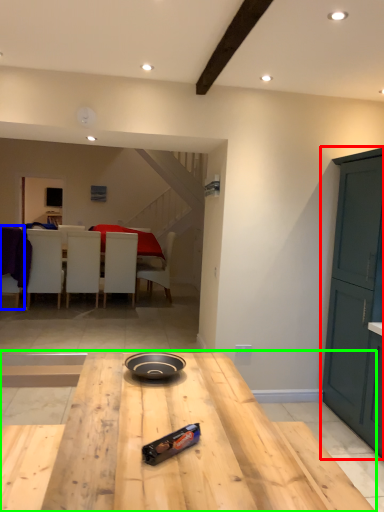
Question: Which is nearer to the cabinetry (highlighted by a red box)? chair (highlighted by a blue box) or table (highlighted by a green box).

Choices:
 (A) chair
 (B) table

Answer: (B)